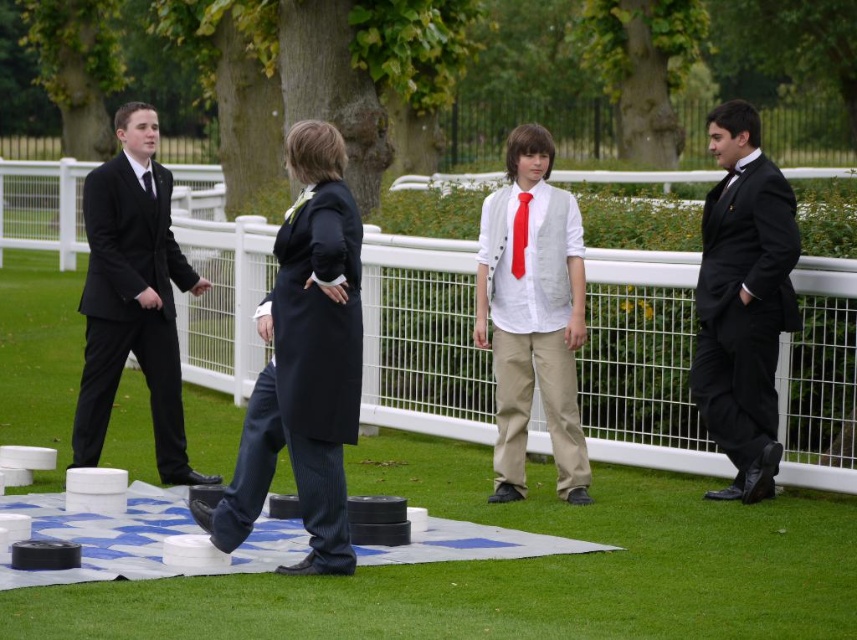
Who is positioned more to the right, white wire fence at center or red satin tie at center?

red satin tie at center is more to the right.

Between white wire fence at center and red satin tie at center, which one has more height?

Standing taller between the two is white wire fence at center.

Does point (13, 200) lie behind point (524, 200)?

Yes, it is.

Where is `white wire fence at center`? white wire fence at center is located at coordinates [642, 362].

This screenshot has height=640, width=857. What do you see at coordinates (519, 234) in the screenshot?
I see `red satin tie at center` at bounding box center [519, 234].

Does red satin tie at center appear on the left side of matte black tie at left?

Incorrect, red satin tie at center is not on the left side of matte black tie at left.

Is point (512, 246) closer to viewer compared to point (153, 188)?

Yes, it is in front of point (153, 188).

Find the location of a particular element. This screenshot has height=640, width=857. red satin tie at center is located at coordinates (519, 234).

Based on the photo, does white wire fence at center appear on the left side of dark blue wool coat at center?

Correct, you'll find white wire fence at center to the left of dark blue wool coat at center.

Which is behind, point (706, 448) or point (351, 340)?

The point (706, 448) is behind.

Locate an element on the screen. The image size is (857, 640). white wire fence at center is located at coordinates (642, 362).